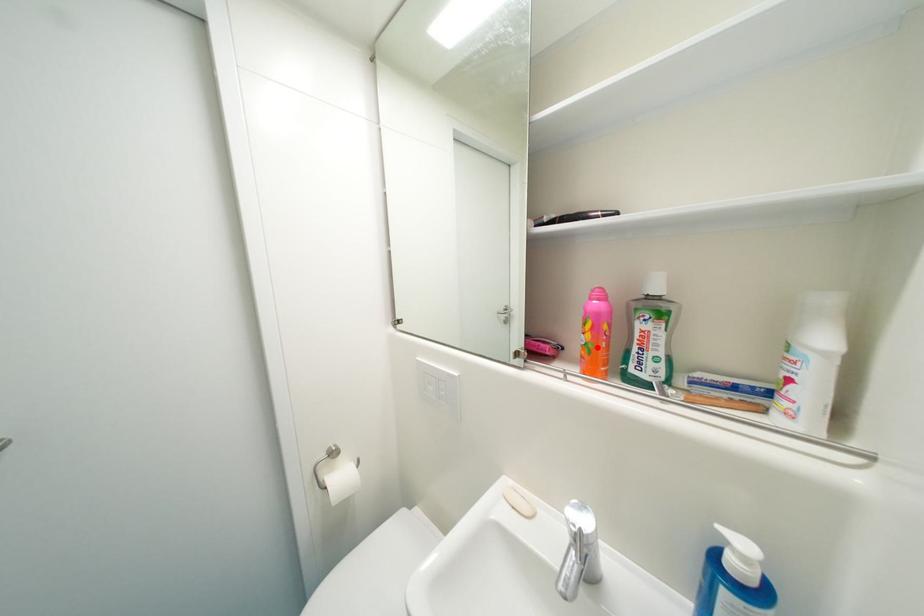
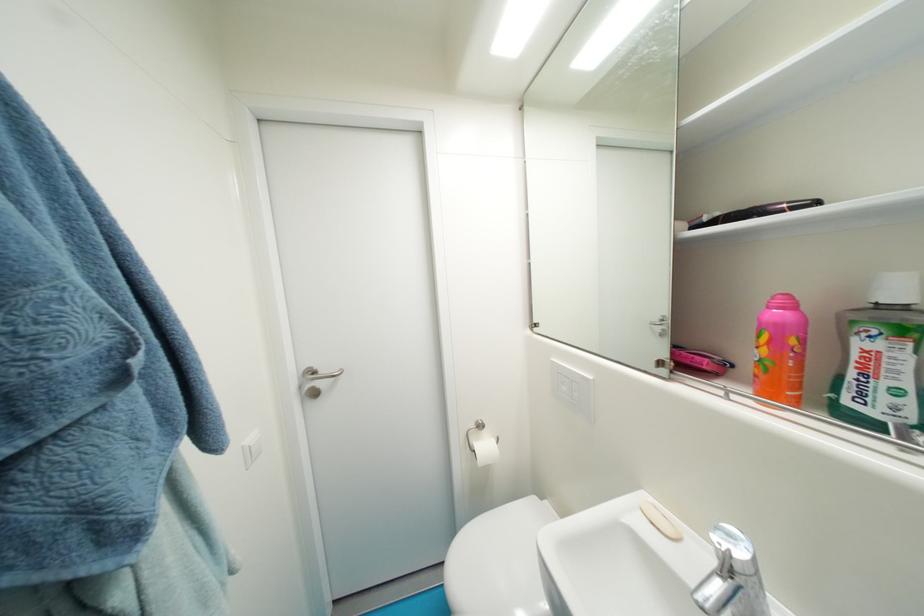
Question: I am providing you with two images of the same scene from different viewpoints. A red point is marked on the first image. Can you still see the location of the red point in image 2?

Choices:
 (A) Yes
 (B) No

Answer: (A)